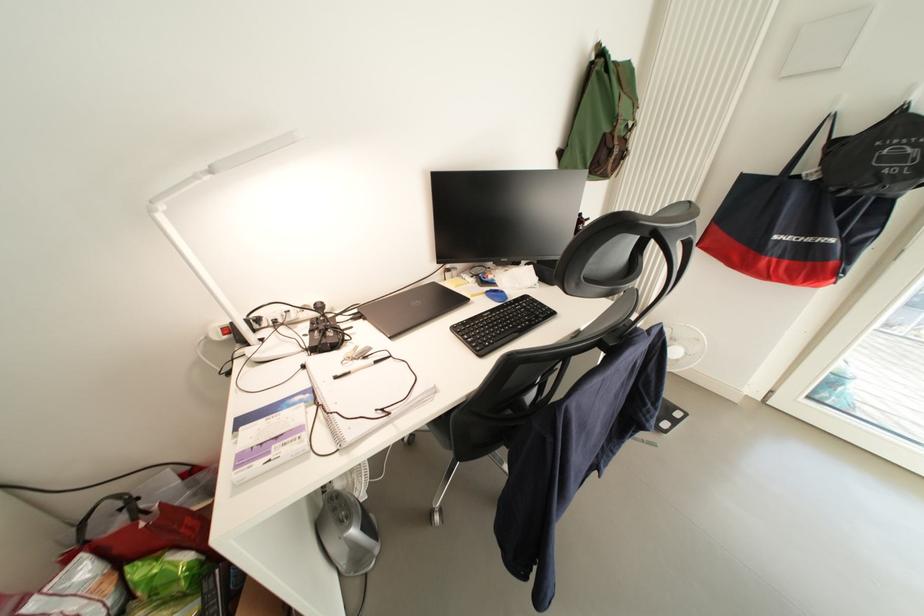
The image size is (924, 616). Find the location of `brown bag strap`. brown bag strap is located at coordinates (602, 118).